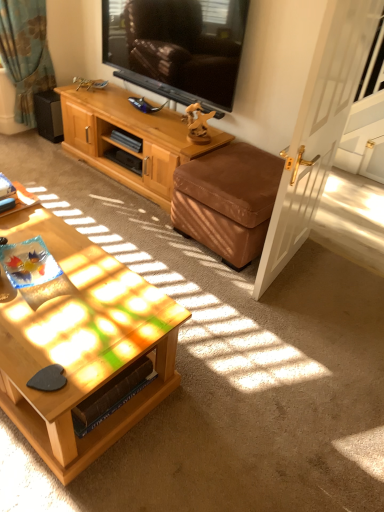
Question: Is white glossy door at right taller than woodenobject at lower left?

Choices:
 (A) yes
 (B) no

Answer: (A)

Question: Is white glossy door at right at the left side of woodenobject at lower left?

Choices:
 (A) no
 (B) yes

Answer: (A)

Question: From the image's perspective, is white glossy door at right beneath woodenobject at lower left?

Choices:
 (A) no
 (B) yes

Answer: (A)

Question: Is white glossy door at right thinner than woodenobject at lower left?

Choices:
 (A) no
 (B) yes

Answer: (B)

Question: Does white glossy door at right appear on the right side of woodenobject at lower left?

Choices:
 (A) yes
 (B) no

Answer: (A)

Question: Is woodenobject at lower left at the back of white glossy door at right?

Choices:
 (A) no
 (B) yes

Answer: (A)

Question: Is black matte speaker at left at the left side of light brown wood cabinet at upper center?

Choices:
 (A) no
 (B) yes

Answer: (B)

Question: From a real-world perspective, is black matte speaker at left under light brown wood cabinet at upper center?

Choices:
 (A) no
 (B) yes

Answer: (B)

Question: Is black matte speaker at left positioned with its back to light brown wood cabinet at upper center?

Choices:
 (A) no
 (B) yes

Answer: (A)

Question: Is black matte speaker at left taller than light brown wood cabinet at upper center?

Choices:
 (A) yes
 (B) no

Answer: (B)

Question: Considering the relative sizes of black matte speaker at left and light brown wood cabinet at upper center in the image provided, is black matte speaker at left smaller than light brown wood cabinet at upper center?

Choices:
 (A) no
 (B) yes

Answer: (B)

Question: Is black matte speaker at left next to light brown wood cabinet at upper center?

Choices:
 (A) yes
 (B) no

Answer: (B)

Question: Considering the relative sizes of black glossy television at upper center and light brown wood cabinet at upper center in the image provided, is black glossy television at upper center taller than light brown wood cabinet at upper center?

Choices:
 (A) no
 (B) yes

Answer: (B)